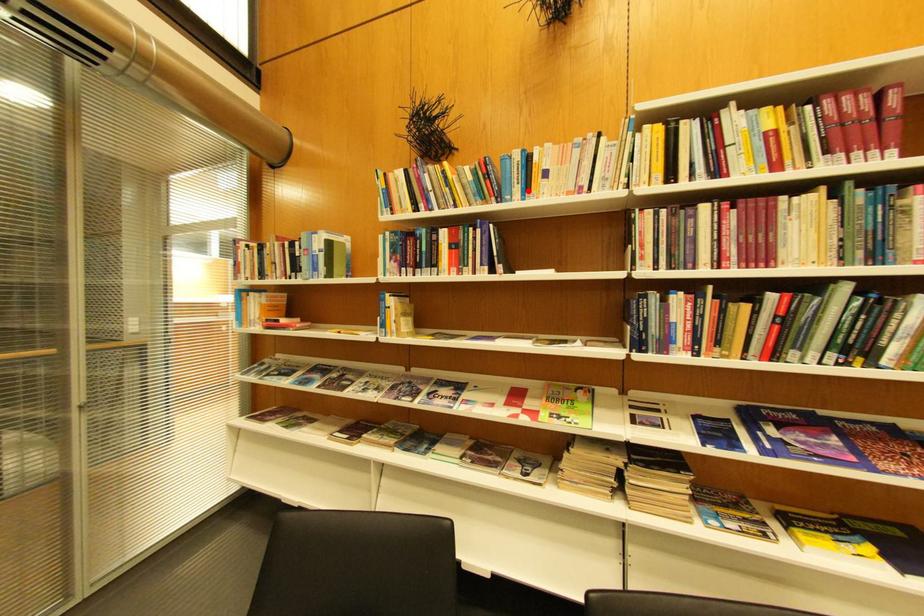
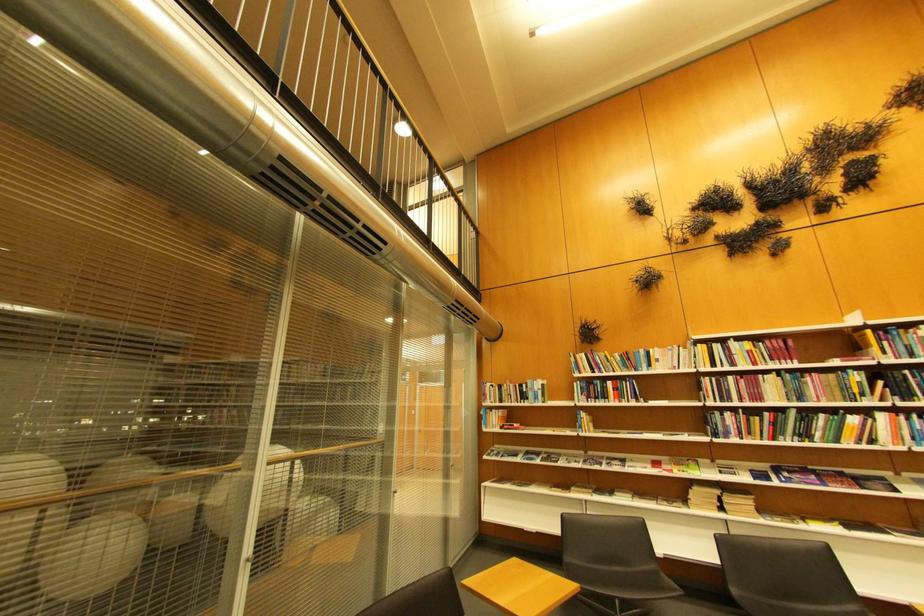
Question: I am providing you with two images of the same scene from different viewpoints. A red point is marked on the first image. Can you still see the location of the red point in image 2?

Choices:
 (A) Yes
 (B) No

Answer: (A)